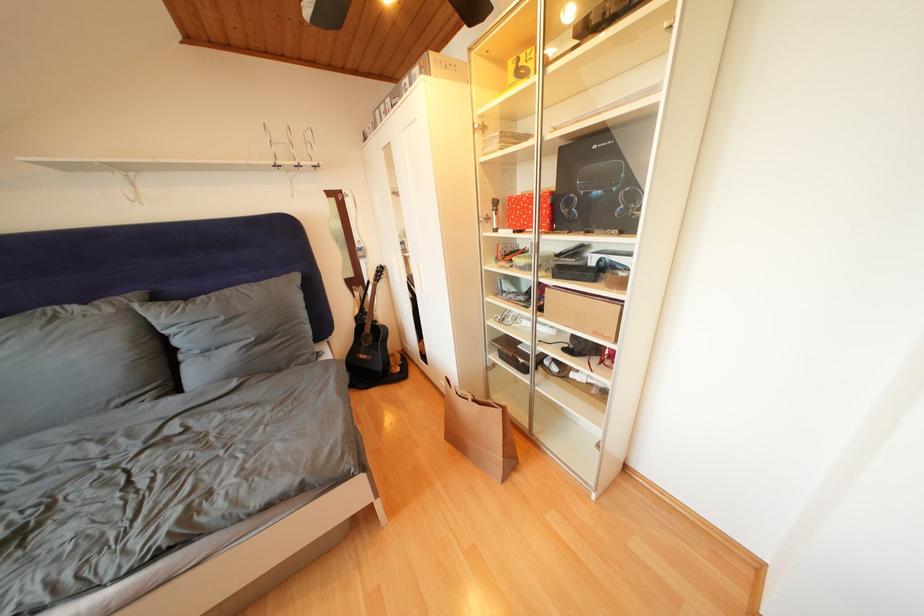
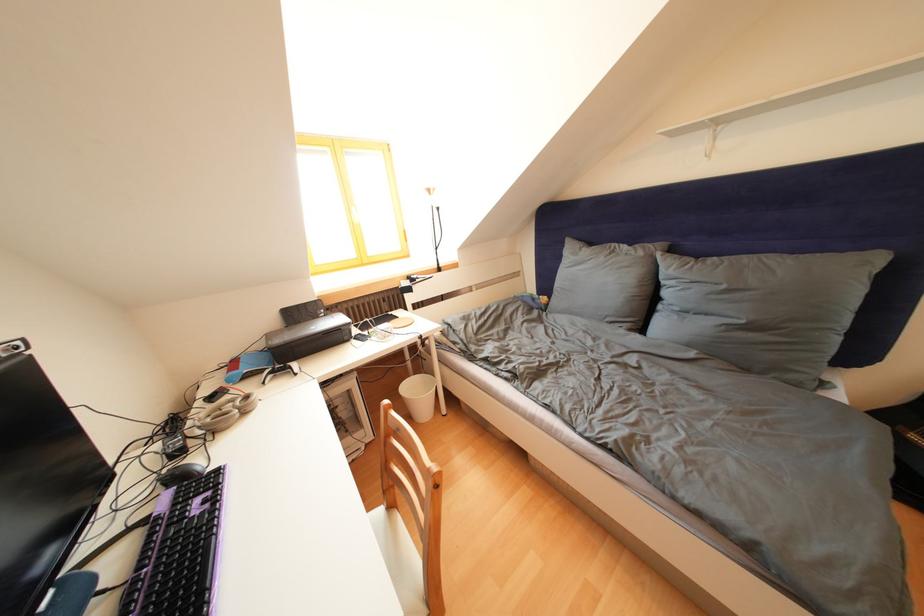
The images are taken continuously from a first-person perspective. In which direction is your viewpoint rotating?

The camera's rotation is toward left-down.